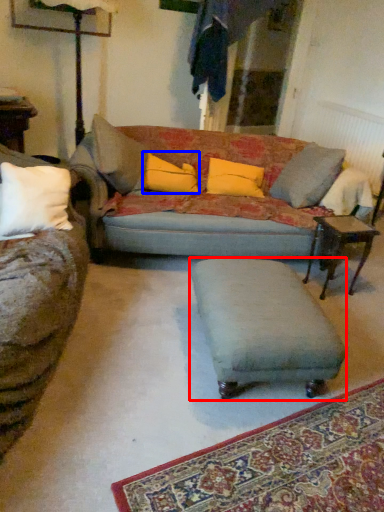
Question: Which object is further to the camera taking this photo, footrest (highlighted by a red box) or pillow (highlighted by a blue box)?

Choices:
 (A) footrest
 (B) pillow

Answer: (B)